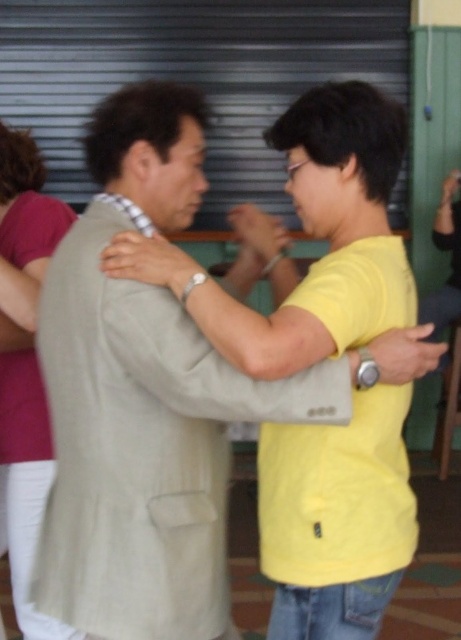
Question: Is the position of light beige suit at center less distant than that of matte pink shirt at left?

Choices:
 (A) no
 (B) yes

Answer: (B)

Question: Can you confirm if light beige suit at center is bigger than matte pink shirt at left?

Choices:
 (A) yes
 (B) no

Answer: (A)

Question: From the image, what is the correct spatial relationship of light beige suit at center in relation to matte pink shirt at left?

Choices:
 (A) right
 (B) left

Answer: (A)

Question: Which of the following is the farthest from the observer?

Choices:
 (A) (22, 570)
 (B) (214, 317)

Answer: (A)